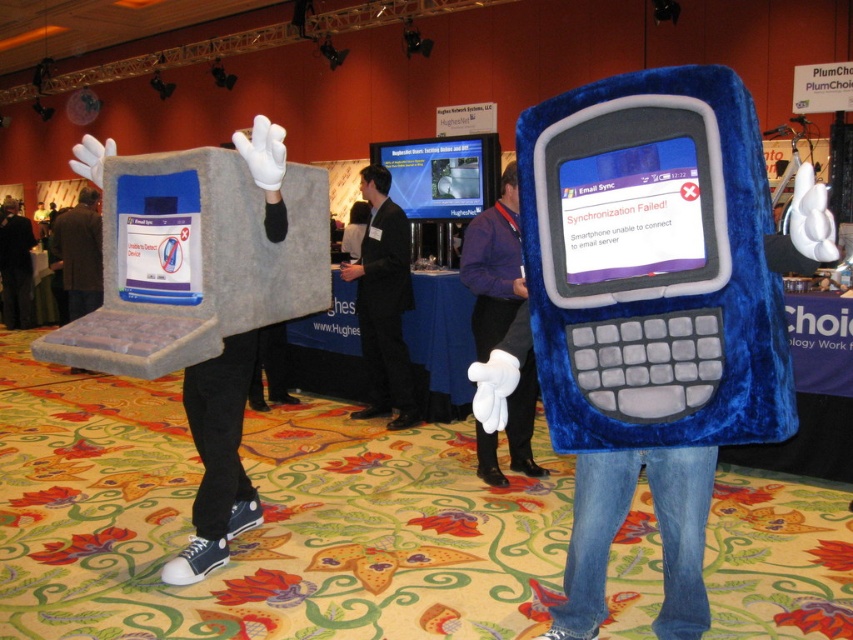
Question: Can you confirm if gray felt laptop at left is thinner than blue plush phone at center?

Choices:
 (A) yes
 (B) no

Answer: (A)

Question: Which object appears closest to the camera in this image?

Choices:
 (A) gray felt laptop at left
 (B) black suit at center

Answer: (A)

Question: Is gray felt laptop at left behind black suit at center?

Choices:
 (A) yes
 (B) no

Answer: (B)

Question: Is gray felt laptop at left smaller than black suit at center?

Choices:
 (A) no
 (B) yes

Answer: (B)

Question: Which of the following is the farthest from the observer?

Choices:
 (A) black suit at center
 (B) blue plush phone at center

Answer: (A)

Question: Which object is closer to the camera taking this photo?

Choices:
 (A) blue plush phone at center
 (B) black suit at center

Answer: (A)